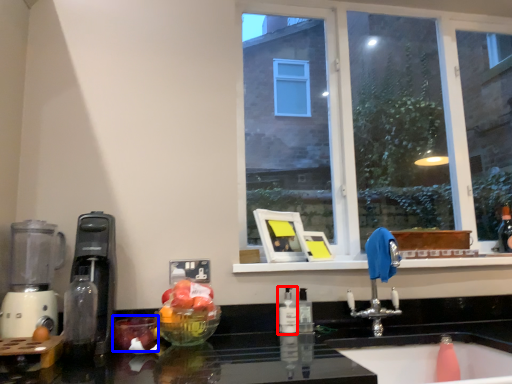
Question: Which point is closer to the camera, bottle (highlighted by a red box) or apple (highlighted by a blue box)?

Choices:
 (A) bottle
 (B) apple

Answer: (B)